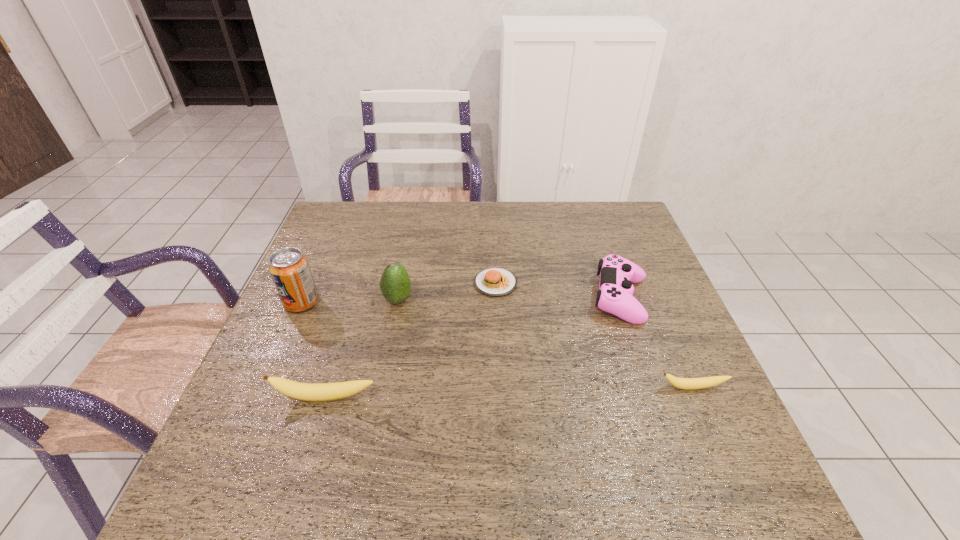
Where is `spot to insert another banana for uniform distribution`? The height and width of the screenshot is (540, 960). spot to insert another banana for uniform distribution is located at coordinates click(511, 393).